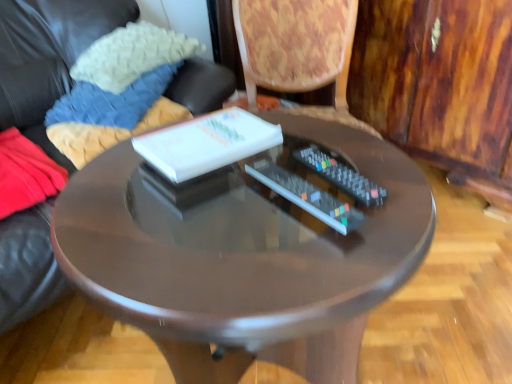
At what (x,y) coordinates should I click in order to perform the action: click on vacant space positioned to the left of matte black remote control at center, the first remote control positioned from the left. Please return your answer as a coordinate pair (x, y). The height and width of the screenshot is (384, 512). Looking at the image, I should click on (138, 231).